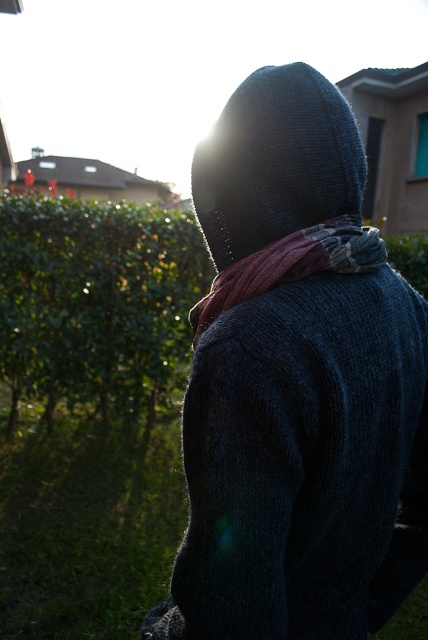
Question: Can you confirm if knitted dark blue at back is wider than knitted wool scarf at center?

Choices:
 (A) no
 (B) yes

Answer: (A)

Question: Which point appears farthest from the camera in this image?

Choices:
 (A) (279, 268)
 (B) (157, 355)
 (C) (315, 353)

Answer: (B)

Question: Can you confirm if green leafy hedge at left is positioned to the right of knitted dark blue at back?

Choices:
 (A) no
 (B) yes

Answer: (A)

Question: Estimate the real-world distances between objects in this image. Which object is farther from the dark knitted hoodie at center?

Choices:
 (A) knitted dark blue at back
 (B) knitted wool scarf at center

Answer: (B)

Question: Considering the relative positions of dark knitted hoodie at center and knitted wool scarf at center in the image provided, where is dark knitted hoodie at center located with respect to knitted wool scarf at center?

Choices:
 (A) left
 (B) right

Answer: (B)

Question: Which point is closer to the camera?

Choices:
 (A) (237, 339)
 (B) (312, 218)
 (C) (41, 221)

Answer: (A)